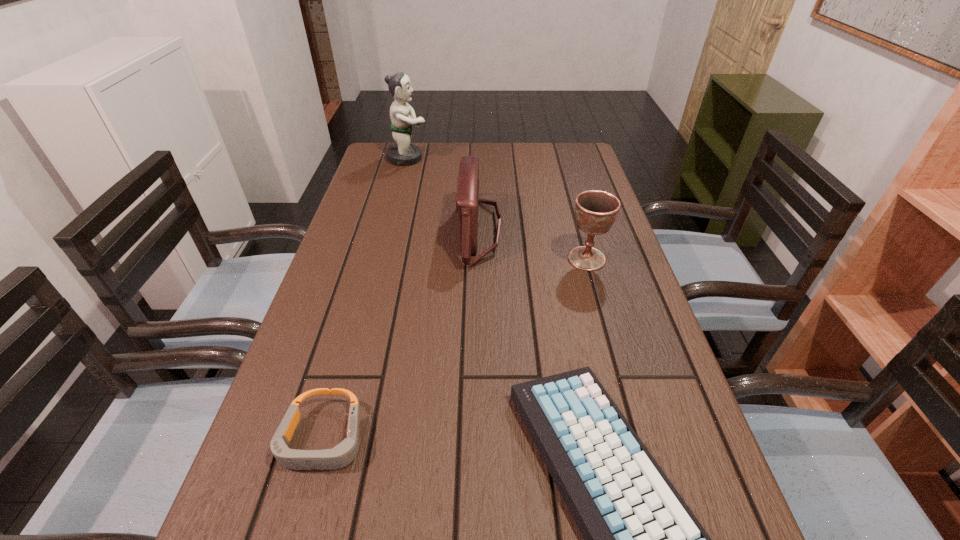
Locate an element on the screen. Image resolution: width=960 pixels, height=540 pixels. free location that satisfies the following two spatial constraints: 1. on the front-facing side of the chalice; 2. on the right side of the farthest object is located at coordinates click(381, 259).

I want to click on vacant space that satisfies the following two spatial constraints: 1. on the front-facing side of the figurine; 2. on the front and back of the goggles, so click(334, 439).

The height and width of the screenshot is (540, 960). I want to click on blank area in the image that satisfies the following two spatial constraints: 1. on the front-facing side of the figurine; 2. on the front and back of the goggles, so click(x=334, y=439).

At what (x,y) coordinates should I click in order to perform the action: click on free space that satisfies the following two spatial constraints: 1. on the front flap of the shoulder bag; 2. on the right side of the chalice. Please return your answer as a coordinate pair (x, y). This screenshot has height=540, width=960. Looking at the image, I should click on (480, 259).

At what (x,y) coordinates should I click in order to perform the action: click on free space that satisfies the following two spatial constraints: 1. on the front-facing side of the chalice; 2. on the left side of the tallest object. Please return your answer as a coordinate pair (x, y). This screenshot has height=540, width=960. Looking at the image, I should click on (381, 259).